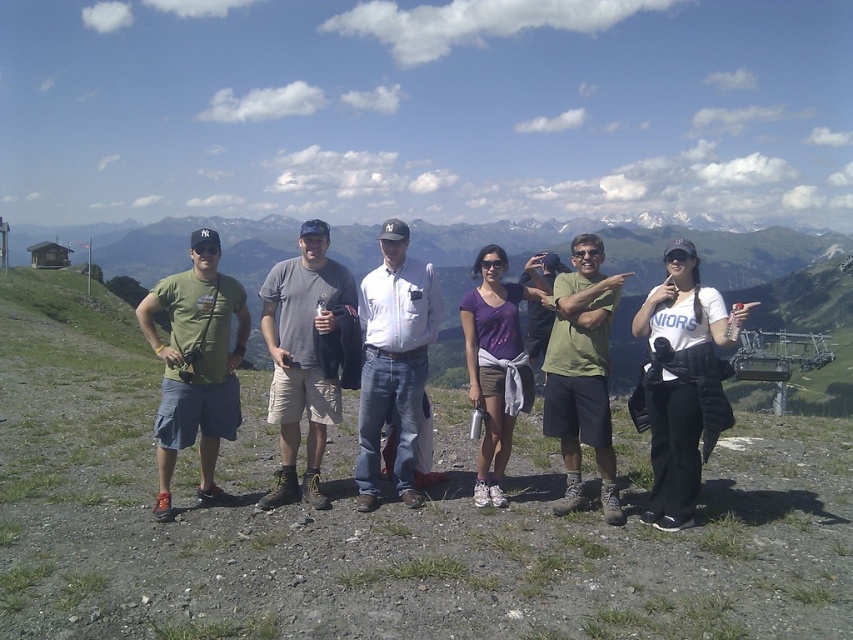
Question: Which object is closer to the camera taking this photo?

Choices:
 (A) green matte t-shirt at left
 (B) white matte shirt at center
 (C) purple cotton shirt at center
 (D) white cotton shirt at center

Answer: (B)

Question: Which point appears closest to the camera in this image?

Choices:
 (A) (659, 360)
 (B) (341, 273)

Answer: (A)

Question: Is gray fabric shirt at center positioned at the back of green matte shorts at center?

Choices:
 (A) yes
 (B) no

Answer: (A)

Question: Among these points, which one is farthest from the camera?

Choices:
 (A) (671, 355)
 (B) (283, 474)

Answer: (B)

Question: Does gray fabric shirt at center appear on the left side of green matte shorts at center?

Choices:
 (A) no
 (B) yes

Answer: (B)

Question: Is gray fabric shirt at center thinner than green matte shorts at center?

Choices:
 (A) yes
 (B) no

Answer: (B)